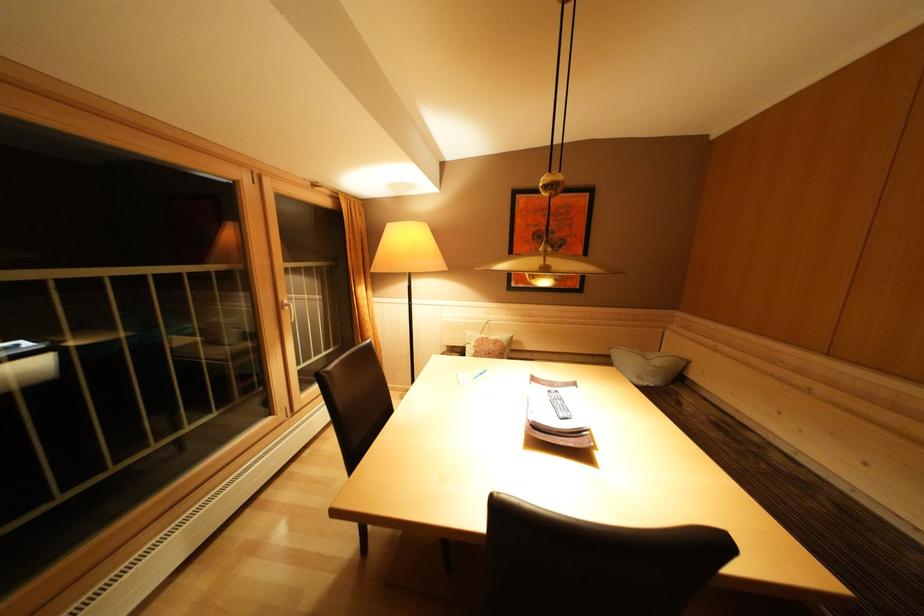
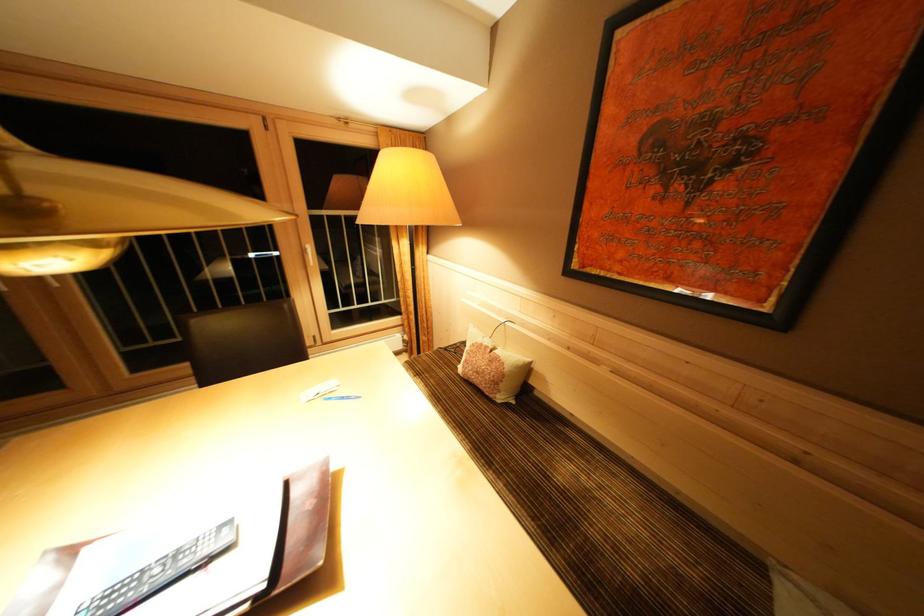
Where in the second image is the point corresponding to (x=493, y=342) from the first image?

(493, 352)